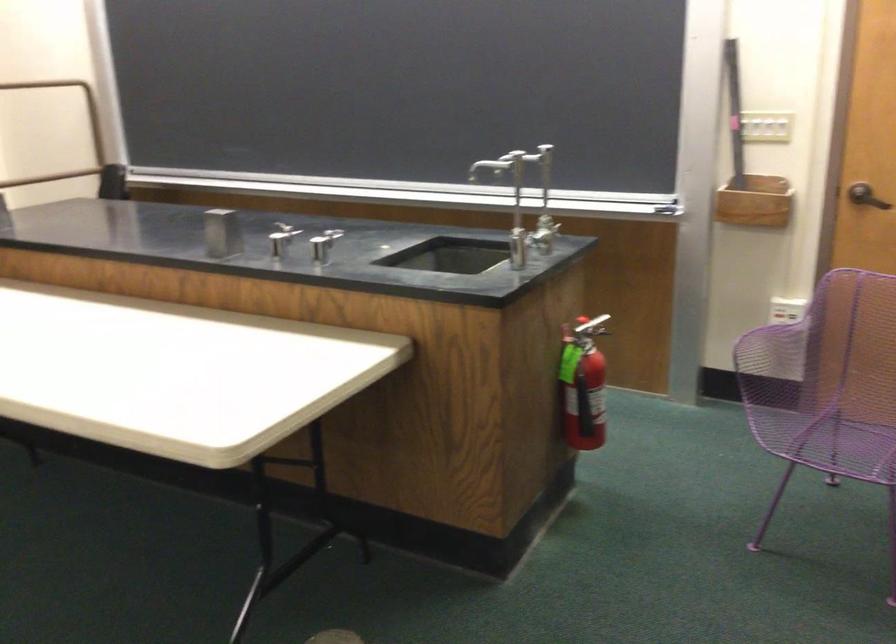
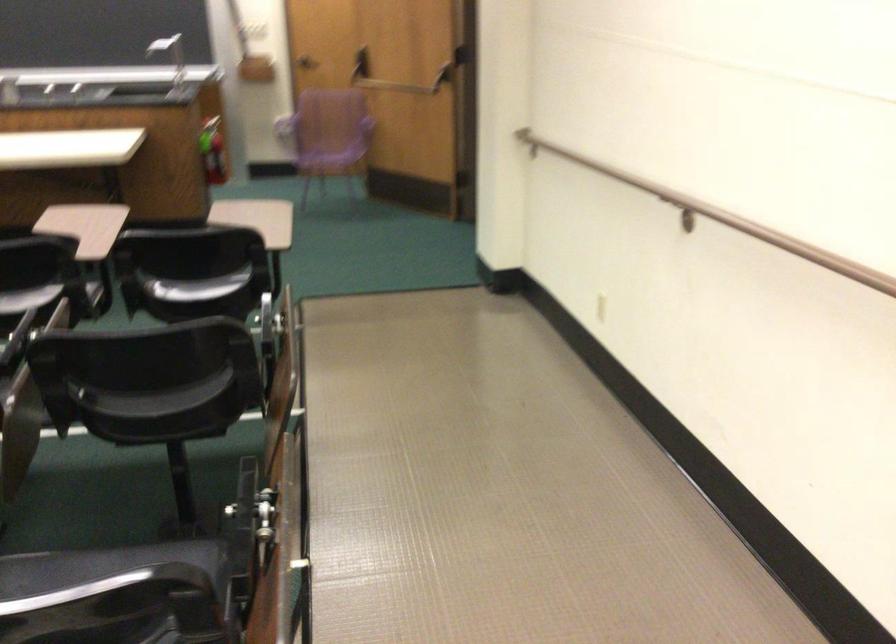
Where in the second image is the point corresponding to point 563,386 from the first image?

(212, 151)